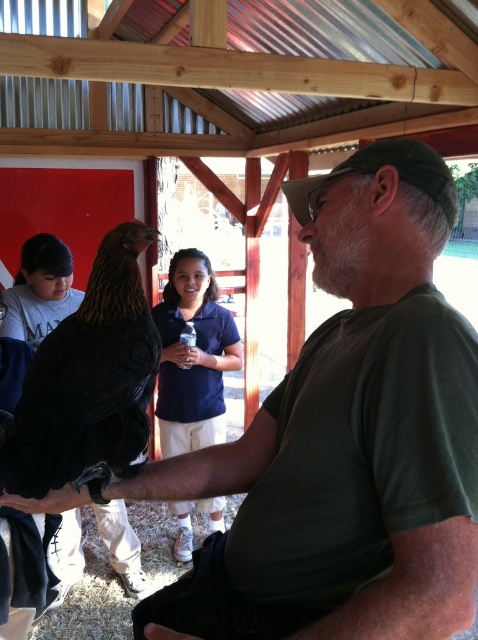
Which is in front, point (17, 420) or point (227, 320)?

Point (17, 420)

Image resolution: width=478 pixels, height=640 pixels. I want to click on black feathered chicken at center, so click(88, 378).